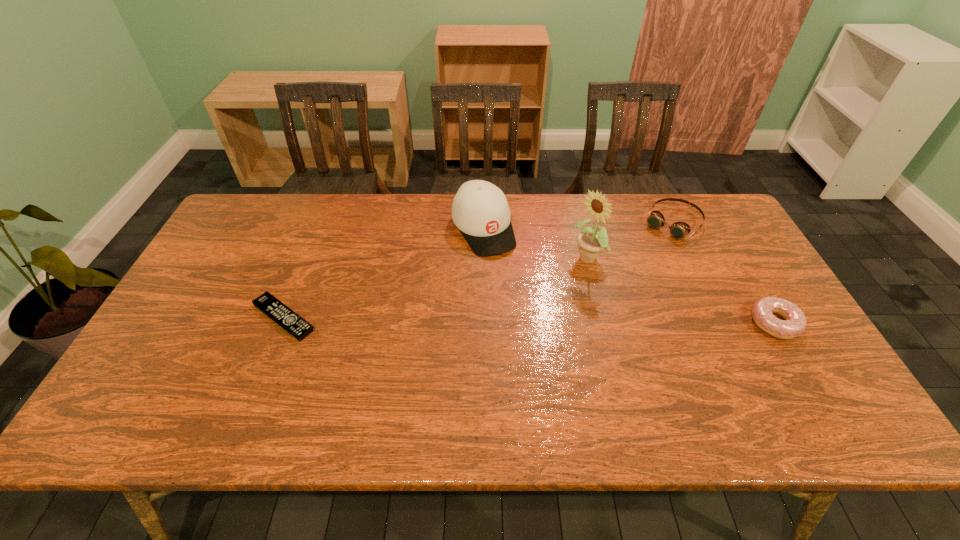
You are a GUI agent. You are given a task and a screenshot of the screen. Output one action in this format:
    pyautogui.click(x=<x>, y=<y>)
    Task: Click on the blank region between the shortest object and the third object from left to right
    The image size is (960, 540).
    Given the screenshot: What is the action you would take?
    pyautogui.click(x=436, y=288)

The image size is (960, 540). I want to click on empty location between the third object from left to right and the goggles, so click(x=630, y=241).

The image size is (960, 540). Find the location of `free space that is in between the fourth shortest object and the shortest object`. free space that is in between the fourth shortest object and the shortest object is located at coordinates (383, 273).

Locate an element on the screen. The width and height of the screenshot is (960, 540). free space between the doughnut and the remote control is located at coordinates (529, 320).

Where is `vacant space that is in between the doughnut and the tallest object`? vacant space that is in between the doughnut and the tallest object is located at coordinates (681, 291).

The width and height of the screenshot is (960, 540). What are the coordinates of `free area in between the leftmost object and the baseball cap` in the screenshot? It's located at (383, 273).

Identify the location of vacant area between the shortest object and the tallest object. (436, 288).

The height and width of the screenshot is (540, 960). Find the location of `free space between the goggles and the shortest object`. free space between the goggles and the shortest object is located at coordinates (478, 270).

Identify which object is the second closest to the goggles. Please provide its 2D coordinates. Your answer should be formatted as a tuple, i.e. [(x, y)], where the tuple contains the x and y coordinates of a point satisfying the conditions above.

[(794, 323)]

Select which object appears as the third closest to the doughnut. Please provide its 2D coordinates. Your answer should be formatted as a tuple, i.e. [(x, y)], where the tuple contains the x and y coordinates of a point satisfying the conditions above.

[(480, 210)]